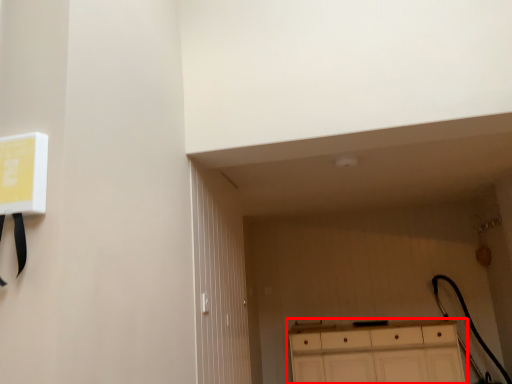
Question: In this image, where is cabinetry (annotated by the red box) located relative to door?

Choices:
 (A) right
 (B) left

Answer: (A)